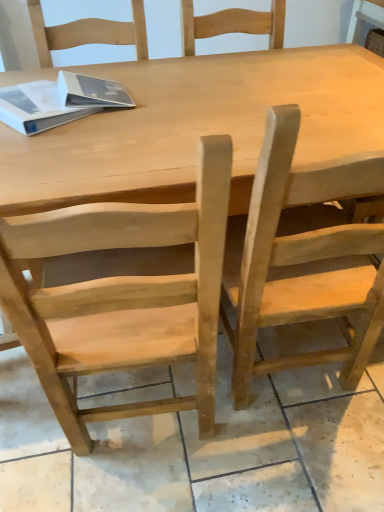
Identify the location of vacant area that lies in front of natural wood chair at right, which ranks as the 1th chair in right-to-left order. The height and width of the screenshot is (512, 384). (287, 458).